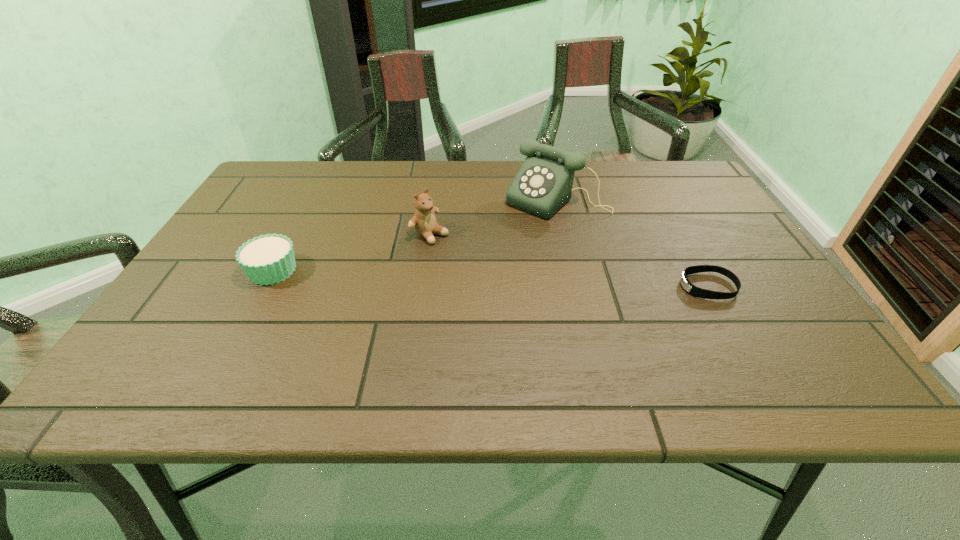
This screenshot has width=960, height=540. I want to click on object that is positioned at the right edge, so click(x=691, y=289).

Identify the location of vacant area at the far edge. The image size is (960, 540). (487, 182).

This screenshot has height=540, width=960. In the image, there is a desktop. What are the coordinates of `free space at the near edge` in the screenshot? It's located at (367, 353).

In the image, there is a desktop. What are the coordinates of `free space at the right edge` in the screenshot? It's located at (732, 272).

In the image, there is a desktop. At what (x,y) coordinates should I click in order to perform the action: click on vacant space at the far left corner. Please return your answer as a coordinate pair (x, y). Looking at the image, I should click on (300, 164).

In the image, there is a desktop. What are the coordinates of `vacant space at the far right corner` in the screenshot? It's located at (651, 191).

Where is `vacant space at the near right corner`? vacant space at the near right corner is located at coordinates (767, 339).

Where is `empty space that is in between the third object from right to left and the tallest object`? This screenshot has width=960, height=540. empty space that is in between the third object from right to left and the tallest object is located at coordinates (493, 217).

Where is `vacant region between the tallest object and the teddy bear`? The image size is (960, 540). vacant region between the tallest object and the teddy bear is located at coordinates (493, 217).

I want to click on free space that is in between the third shortest object and the second shortest object, so click(351, 252).